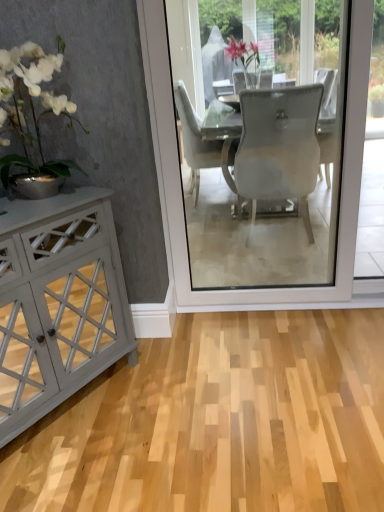
Question: Is matte gray cabinet at left spatially inside transparent glass screen door at center, or outside of it?

Choices:
 (A) outside
 (B) inside

Answer: (A)

Question: Visually, is matte gray cabinet at left positioned to the left or to the right of transparent glass screen door at center?

Choices:
 (A) right
 (B) left

Answer: (B)

Question: Estimate the real-world distances between objects in this image. Which object is farther from the matte gray cabinet at left?

Choices:
 (A) transparent glass screen door at center
 (B) white glossy vase at left

Answer: (A)

Question: Considering the real-world distances, which object is closest to the white glossy vase at left?

Choices:
 (A) matte gray cabinet at left
 (B) transparent glass screen door at center

Answer: (A)